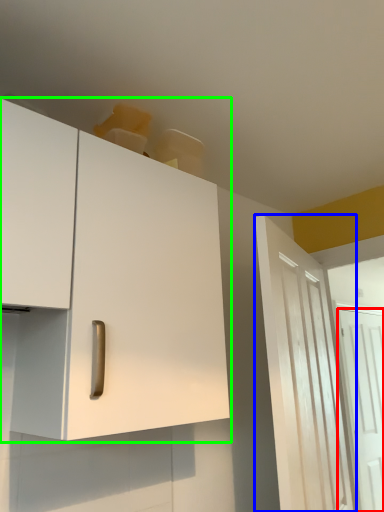
Question: Which is farther away from door (highlighted by a red box)? door (highlighted by a blue box) or cabinetry (highlighted by a green box)?

Choices:
 (A) door
 (B) cabinetry

Answer: (B)